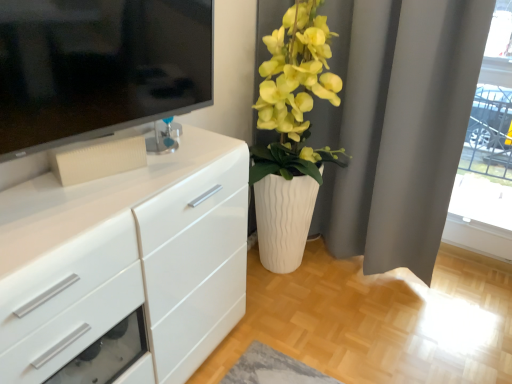
Question: From a real-world perspective, is white glossy chest of drawers at left positioned under white matte curtain at upper right based on gravity?

Choices:
 (A) no
 (B) yes

Answer: (B)

Question: Does white glossy chest of drawers at left appear on the left side of white matte curtain at upper right?

Choices:
 (A) yes
 (B) no

Answer: (A)

Question: Can you confirm if white glossy chest of drawers at left is shorter than white matte curtain at upper right?

Choices:
 (A) yes
 (B) no

Answer: (A)

Question: Is white matte curtain at upper right at the back of white glossy chest of drawers at left?

Choices:
 (A) no
 (B) yes

Answer: (A)

Question: Can you confirm if white glossy chest of drawers at left is positioned to the right of white matte curtain at upper right?

Choices:
 (A) yes
 (B) no

Answer: (B)

Question: Which is correct: matte white vase at center right is inside transparent glass door at upper right, or outside of it?

Choices:
 (A) outside
 (B) inside

Answer: (A)

Question: Based on their sizes in the image, would you say matte white vase at center right is bigger or smaller than transparent glass door at upper right?

Choices:
 (A) big
 (B) small

Answer: (A)

Question: From the image's perspective, relative to transparent glass door at upper right, is matte white vase at center right above or below?

Choices:
 (A) below
 (B) above

Answer: (A)

Question: Considering the relative positions of matte white vase at center right and transparent glass door at upper right in the image provided, is matte white vase at center right to the left or to the right of transparent glass door at upper right?

Choices:
 (A) right
 (B) left

Answer: (B)

Question: Looking at the image, does white glossy chest of drawers at left seem bigger or smaller compared to matte white vase at center right?

Choices:
 (A) small
 (B) big

Answer: (A)

Question: Does point (34, 210) appear closer or farther from the camera than point (285, 261)?

Choices:
 (A) farther
 (B) closer

Answer: (B)

Question: From a real-world perspective, is white glossy chest of drawers at left positioned above or below matte white vase at center right?

Choices:
 (A) below
 (B) above

Answer: (A)

Question: Based on their positions, is white glossy chest of drawers at left located to the left or right of matte white vase at center right?

Choices:
 (A) left
 (B) right

Answer: (A)

Question: From the image's perspective, relative to white matte curtain at upper right, is transparent glass door at upper right above or below?

Choices:
 (A) above
 (B) below

Answer: (A)

Question: Considering the positions of transparent glass door at upper right and white matte curtain at upper right in the image, is transparent glass door at upper right bigger or smaller than white matte curtain at upper right?

Choices:
 (A) big
 (B) small

Answer: (B)